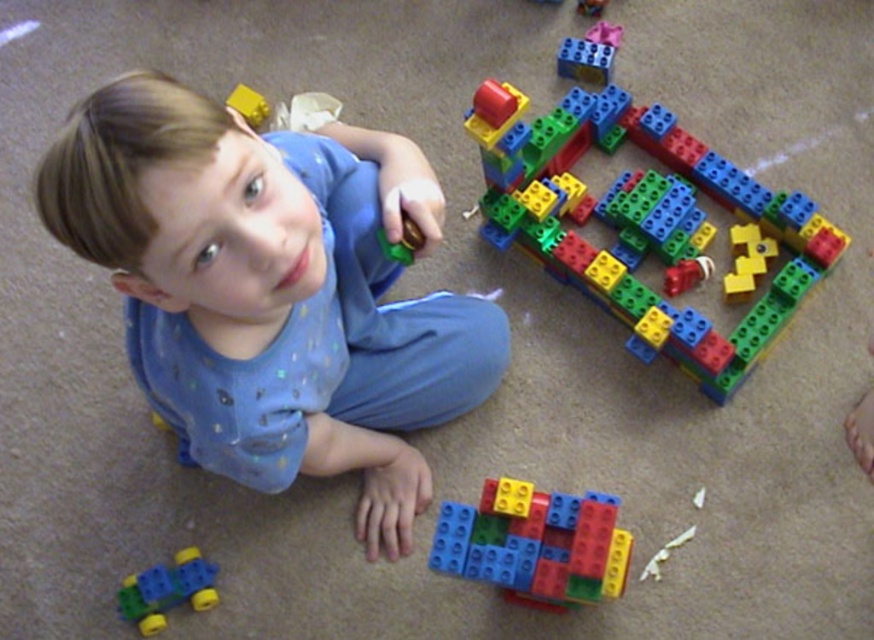
Who is more forward, (288, 184) or (136, 595)?

Point (288, 184) is in front.

Is blue cotton toddler at upper left taller than green plastic toy car at lower left?

Correct, blue cotton toddler at upper left is much taller as green plastic toy car at lower left.

Does point (373, 536) lie behind point (185, 548)?

That is False.

The image size is (874, 640). I want to click on blue cotton toddler at upper left, so (x=272, y=291).

Can you confirm if translucent plastic building blocks at center is positioned to the right of green plastic toy car at lower left?

Indeed, translucent plastic building blocks at center is positioned on the right side of green plastic toy car at lower left.

Is point (545, 224) positioned before point (123, 584)?

No, it is not.

What are the coordinates of `translucent plastic building blocks at center` in the screenshot? It's located at (637, 205).

Who is shorter, blue cotton toddler at upper left or translucent plastic building blocks at center?

blue cotton toddler at upper left

Is point (313, 172) positioned behind point (545, 132)?

No, it is not.

You are a GUI agent. You are given a task and a screenshot of the screen. Output one action in this format:
    pyautogui.click(x=<x>, y=<y>)
    Task: Click on the blue cotton toddler at upper left
    This screenshot has height=640, width=874.
    Given the screenshot: What is the action you would take?
    tap(272, 291)